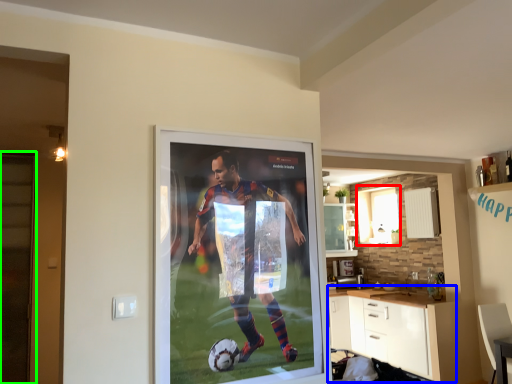
Question: Which object is the farthest from window (highlighted by a red box)? Choose among these: cabinetry (highlighted by a blue box) or screen door (highlighted by a green box).

Choices:
 (A) cabinetry
 (B) screen door

Answer: (B)